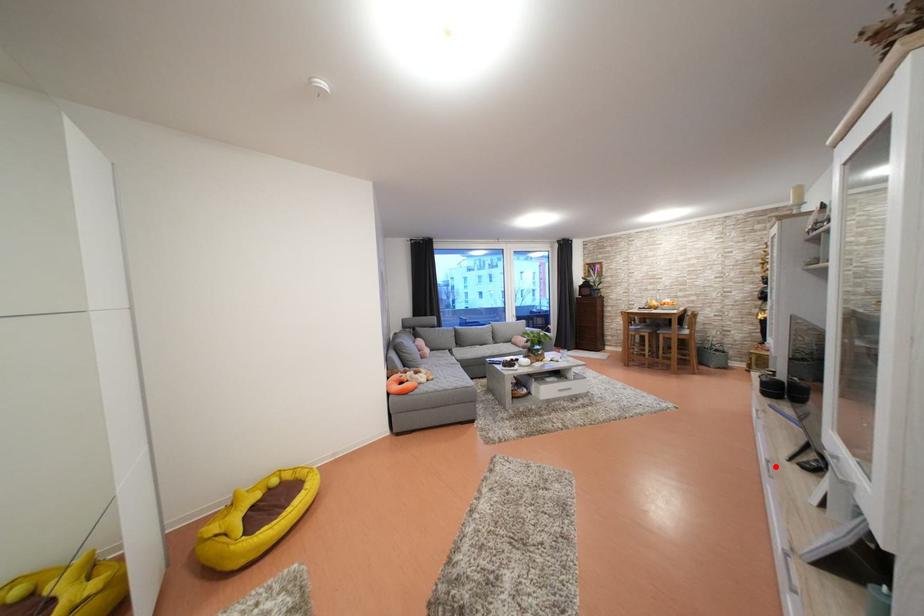
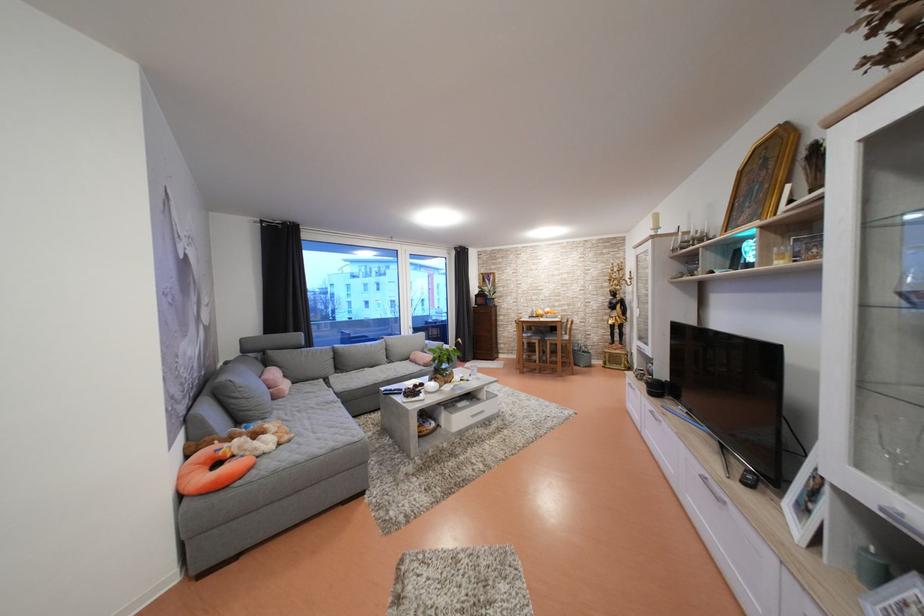
Question: I am providing you with two images of the same scene from different viewpoints. In image1, a red point is highlighted. Considering the same 3D point in image2, which of the following is correct?

Choices:
 (A) It is closer
 (B) It is farther

Answer: (A)